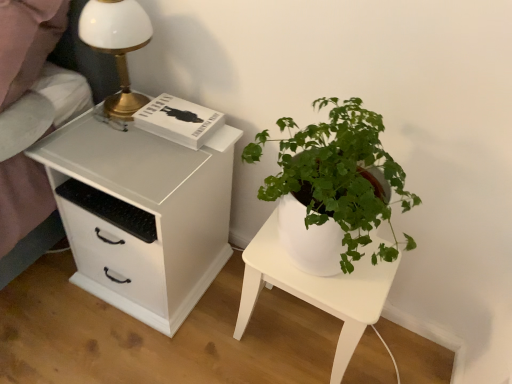
I want to click on blank space above white matte chest of drawers at left (from a real-world perspective), so click(x=135, y=149).